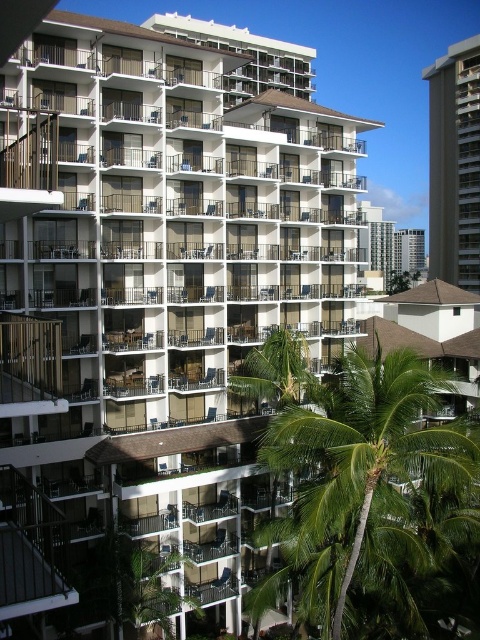
Question: Which object is closer to the camera taking this photo?

Choices:
 (A) white glass condominium at upper right
 (B) green leafy palm tree at center
 (C) smooth concrete building at right
 (D) green leafy palm tree at lower right

Answer: (D)

Question: Based on their relative distances, which object is farther from the green leafy palm tree at center?

Choices:
 (A) smooth concrete building at right
 (B) white glass condominium at upper right
 (C) green leafy palm tree at lower right

Answer: (B)

Question: Does green leafy palm tree at center appear over white glass condominium at upper right?

Choices:
 (A) yes
 (B) no

Answer: (B)

Question: Which point is closer to the camera?

Choices:
 (A) green leafy palm tree at center
 (B) green leafy palm tree at lower right

Answer: (B)

Question: Considering the relative positions of green leafy palm tree at lower right and smooth concrete building at right in the image provided, where is green leafy palm tree at lower right located with respect to smooth concrete building at right?

Choices:
 (A) above
 (B) below

Answer: (B)

Question: Does green leafy palm tree at center appear under white glass condominium at upper right?

Choices:
 (A) no
 (B) yes

Answer: (B)